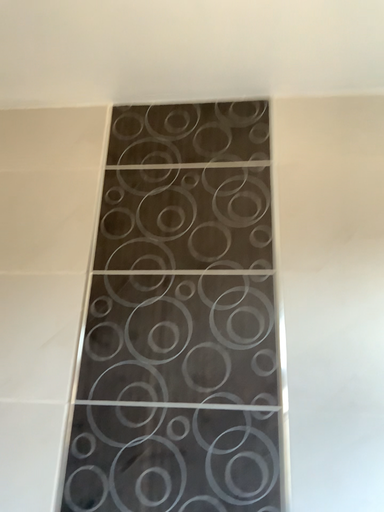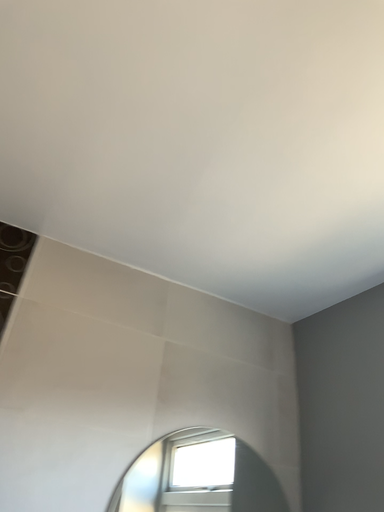
Question: How did the camera likely rotate when shooting the video?

Choices:
 (A) rotated left
 (B) rotated right

Answer: (B)